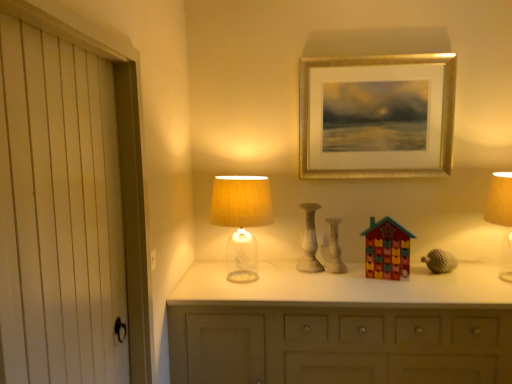
The width and height of the screenshot is (512, 384). I want to click on free location above gold metallic picture frame at upper center (from a real-world perspective), so click(380, 59).